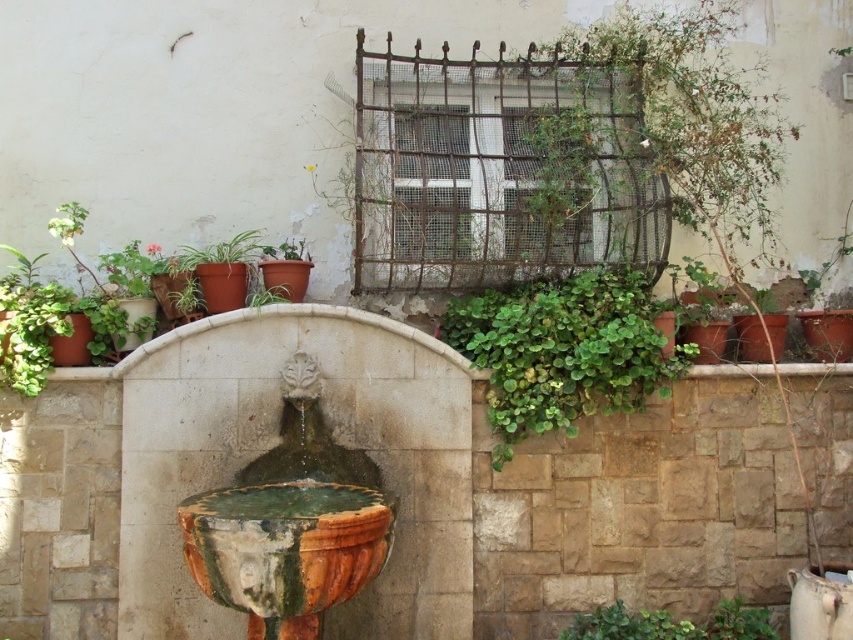
You are standing at the point labeled as point (x=289, y=522) in the image. Based on the scene description, what object are you currently positioned at?

The point (x=289, y=522) corresponds to the green glazed stone fountain at center.

You are standing in front of the fountain and want to place a new plant in the exact center of the matte terracotta pot at center. According to the scene description, where should you position the new plant?

The exact center of the matte terracotta pot at center is located at the 2D coordinates point (57, 324).